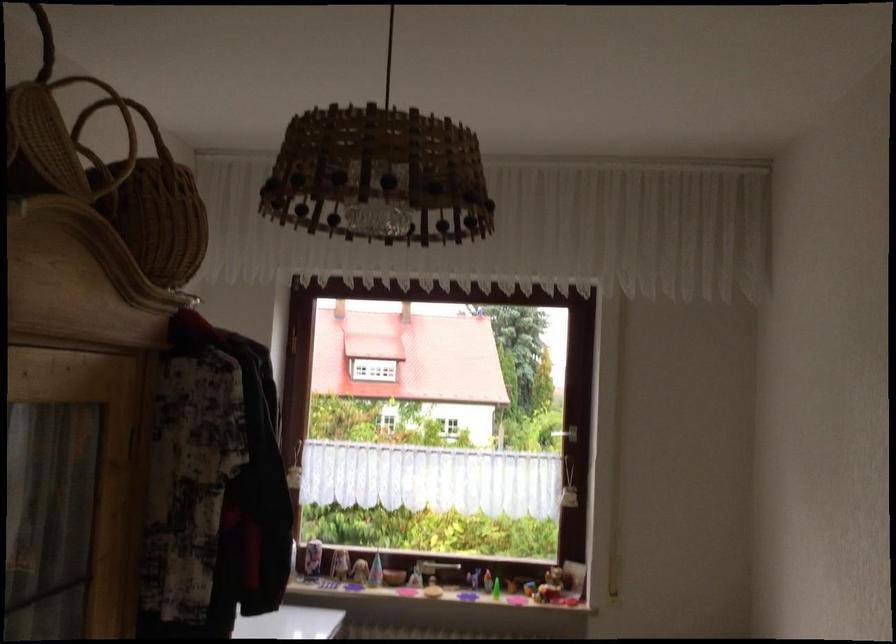
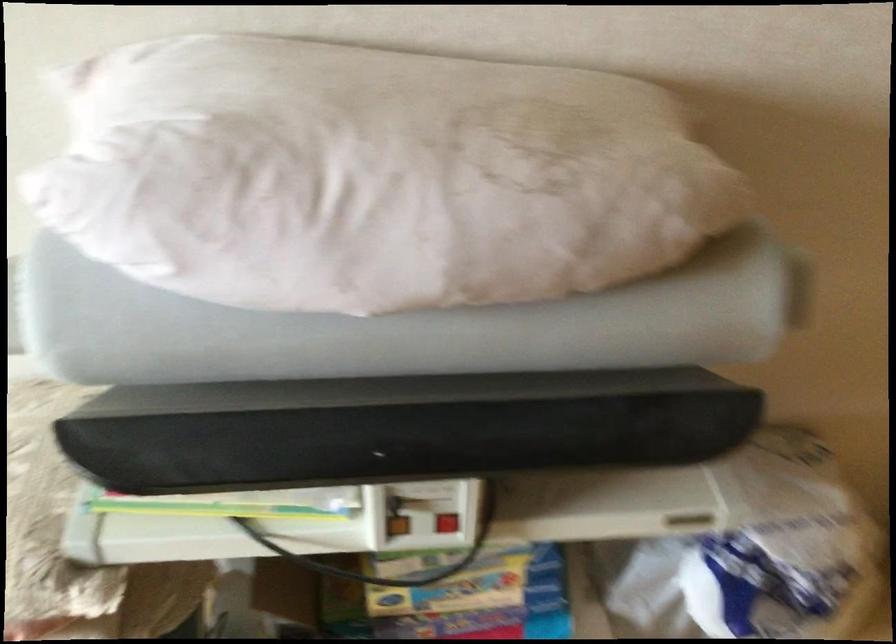
The first image is from the beginning of the video and the second image is from the end. How did the camera likely rotate when shooting the video?

The camera's rotation is toward right-down.